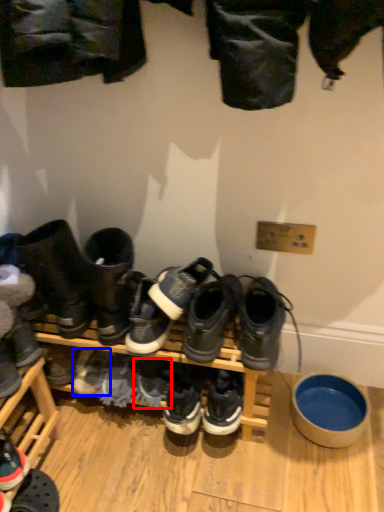
Question: Which of the following is the farthest to the observer, shoe (highlighted by a red box) or footwear (highlighted by a blue box)?

Choices:
 (A) shoe
 (B) footwear

Answer: (B)